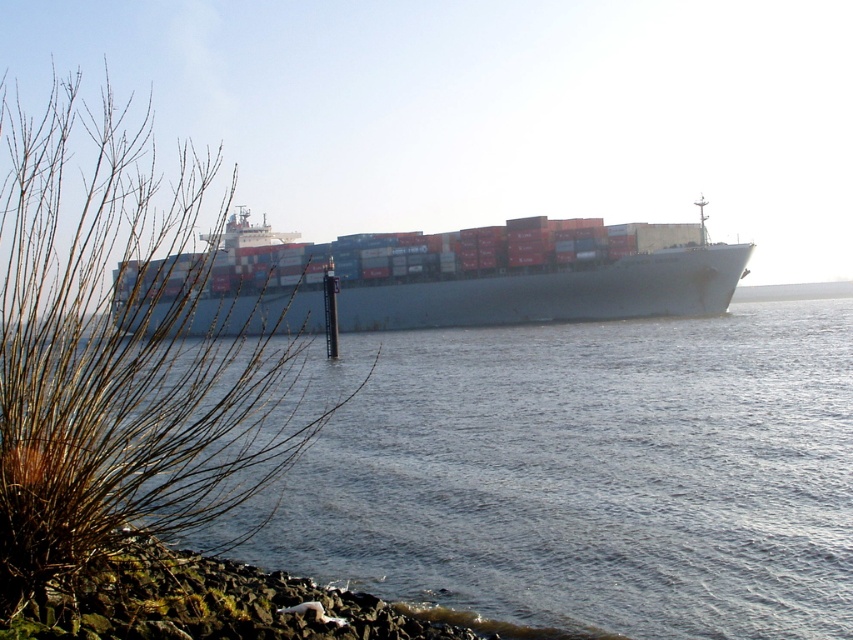
You are a sailor on the blue matte container ship at center. You notice the gray water at center ahead. Which direction should you steer to avoid it?

The gray water at center is to the right of the blue matte container ship at center, so you should steer to the left to avoid it.

In the scene shown: You are standing on the rocky shoreline and see the cargo ship with shipping containers. There is a specific point marked at coordinates point (119, 355). What is located at that point?

At point (119, 355) lies brown dry grass at left.

You are a photographer trying to capture the gray water at center and the brown dry grass at left in a single shot. Based on their positions, which object should you focus on first if you want to ensure both are in the frame?

The gray water at center is to the right of brown dry grass at left, so you should focus on the brown dry grass at left first as it is on the left side of the frame to ensure both are included in the shot.